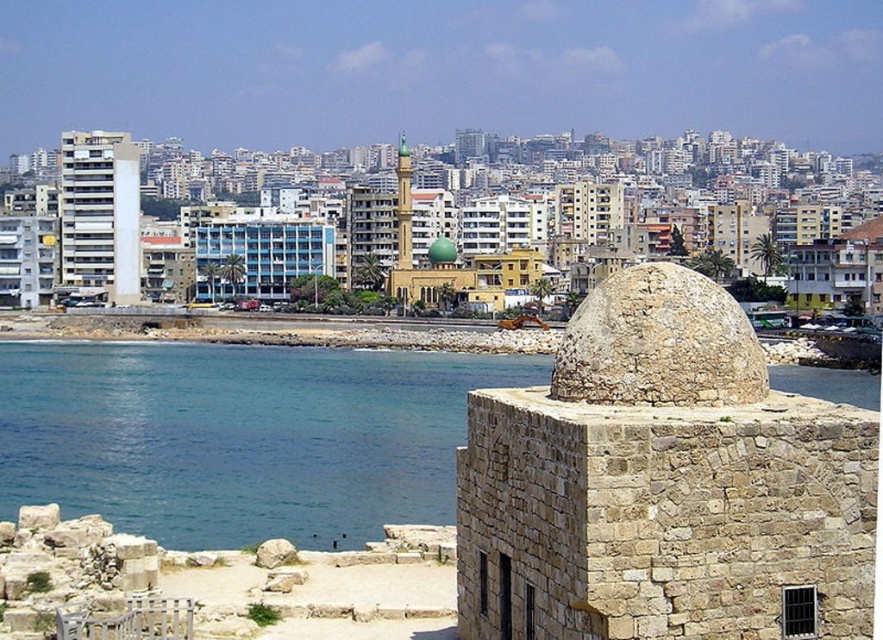
You are standing at point A, which is located at coordinates (99, 212). From this position, you want to walk towards the white smooth building at left. Is the path clear of any obstacles between your current position and the building?

The path between your current position at point A and the white smooth building at left is clear of any obstacles as there are no objects listed in the scene description that would block the way.

You are standing on the beach looking towards the brown stone dome at center and the smooth gray rock at lower left. Which object is closer to you?

The brown stone dome at center is closer to you because it is in front of the smooth gray rock at lower left.